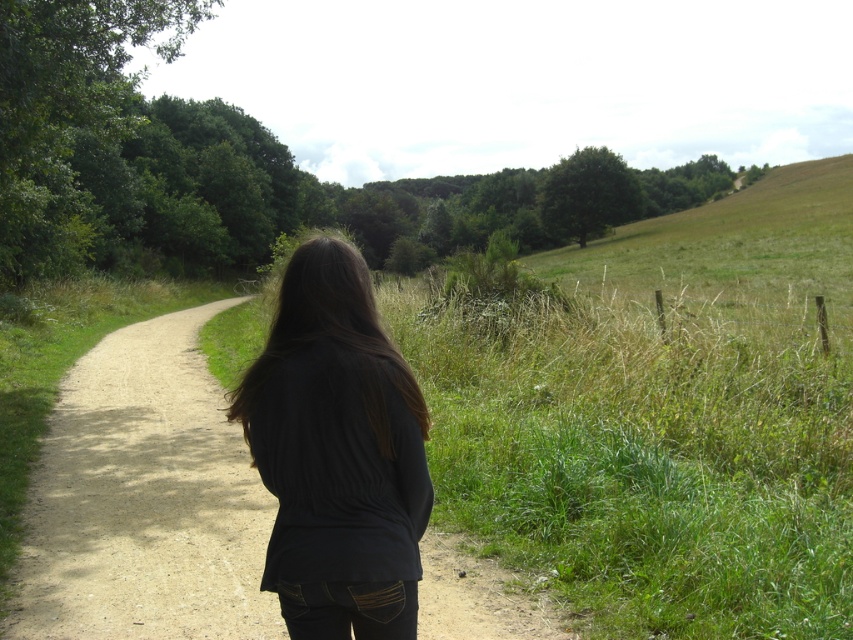
Does dirt path at center have a larger size compared to black matte shirt at center?

Yes, dirt path at center is bigger than black matte shirt at center.

Between dirt path at center and black matte shirt at center, which one is positioned lower?

dirt path at center

The image size is (853, 640). Find the location of `dirt path at center`. dirt path at center is located at coordinates (144, 500).

Locate an element on the screen. dirt path at center is located at coordinates (144, 500).